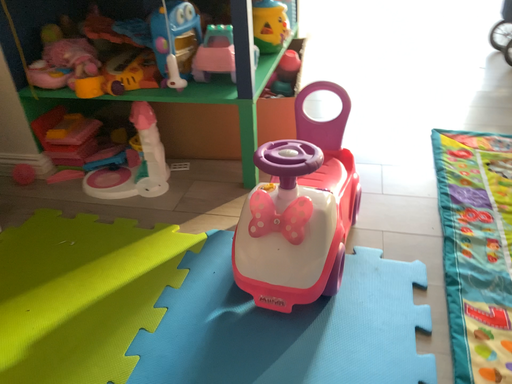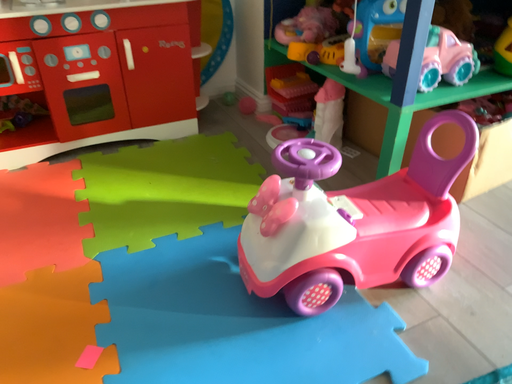
Question: How did the camera likely rotate when shooting the video?

Choices:
 (A) rotated downward
 (B) rotated upward

Answer: (B)